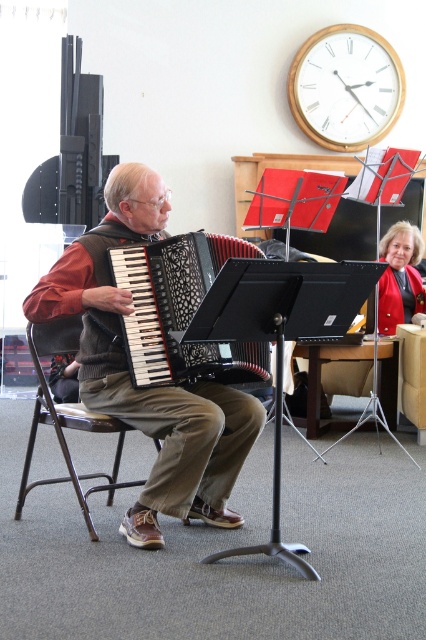
Between matte black accordion at center and velvet red jacket at upper right, which one has more height?

Standing taller between the two is matte black accordion at center.

Which is below, matte black accordion at center or velvet red jacket at upper right?

matte black accordion at center

Does point (143, 204) come farther from viewer compared to point (405, 237)?

That is False.

Where is `matte black accordion at center`? This screenshot has height=640, width=426. matte black accordion at center is located at coordinates (149, 387).

Between point (129, 360) and point (36, 404), which one is positioned in front?

Positioned in front is point (129, 360).

Between black matte accordion at center and metallic silver chair at left, which one appears on the left side from the viewer's perspective?

From the viewer's perspective, metallic silver chair at left appears more on the left side.

Locate an element on the screen. black matte accordion at center is located at coordinates (180, 310).

Does black matte accordion at center have a lesser height compared to velvet red jacket at upper right?

Indeed, black matte accordion at center has a lesser height compared to velvet red jacket at upper right.

Where is `black matte accordion at center`? black matte accordion at center is located at coordinates (180, 310).

The height and width of the screenshot is (640, 426). Identify the location of black matte accordion at center. tap(180, 310).